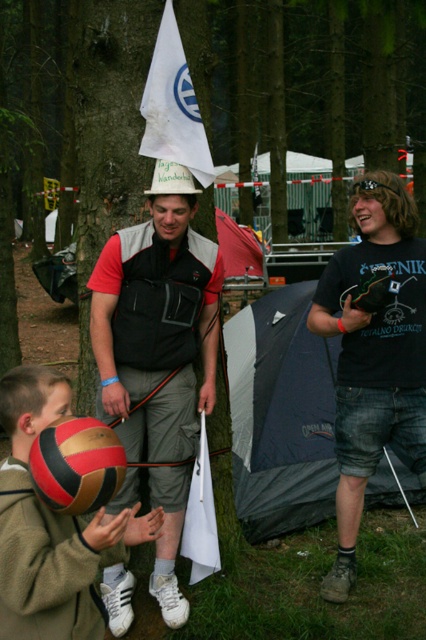
Question: Is matte black vest at center smaller than brown leather ball at lower left?

Choices:
 (A) no
 (B) yes

Answer: (A)

Question: Does matte black vest at center come behind brown leather ball at lower left?

Choices:
 (A) no
 (B) yes

Answer: (B)

Question: Which object appears farthest from the camera in this image?

Choices:
 (A) red and gold textured volleyball at lower left
 (B) matte black vest at center
 (C) brown leather ball at lower left
 (D) dark blue tarp at center

Answer: (D)

Question: Which point appears closest to the camera in this image?

Choices:
 (A) (120, 433)
 (B) (400, 502)
 (C) (104, 627)
 (D) (58, 461)

Answer: (D)

Question: Is matte black vest at center thinner than dark blue tarp at center?

Choices:
 (A) yes
 (B) no

Answer: (A)

Question: Considering the real-world distances, which object is closest to the dark blue tarp at center?

Choices:
 (A) brown leather ball at lower left
 (B) matte black vest at center

Answer: (B)